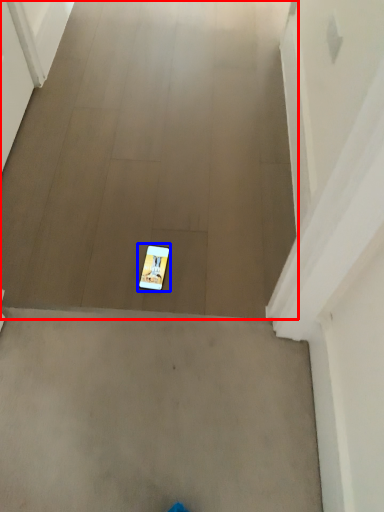
Question: Which object appears closest to the camera in this image, concrete (highlighted by a red box) or mobile phone (highlighted by a blue box)?

Choices:
 (A) concrete
 (B) mobile phone

Answer: (A)